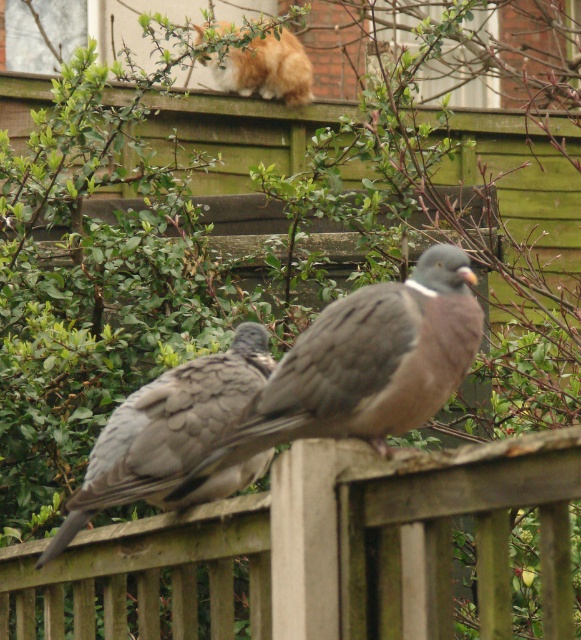
Question: Considering the relative positions of gray feathered pigeon at center and orange and white fur cat at upper center in the image provided, where is gray feathered pigeon at center located with respect to orange and white fur cat at upper center?

Choices:
 (A) right
 (B) left

Answer: (A)

Question: Is gray speckled pigeon at center below orange and white fur cat at upper center?

Choices:
 (A) no
 (B) yes

Answer: (B)

Question: Which object appears closest to the camera in this image?

Choices:
 (A) gray speckled pigeon at center
 (B) orange and white fur cat at upper center
 (C) wooden fence at center

Answer: (C)

Question: In this image, where is gray speckled pigeon at center located relative to orange and white fur cat at upper center?

Choices:
 (A) below
 (B) above

Answer: (A)

Question: Among these objects, which one is farthest from the camera?

Choices:
 (A) gray speckled pigeon at center
 (B) orange and white fur cat at upper center

Answer: (B)

Question: Which of the following is the closest to the observer?

Choices:
 (A) wooden fence at center
 (B) orange and white fur cat at upper center
 (C) gray feathered pigeon at center
 (D) gray speckled pigeon at center

Answer: (A)